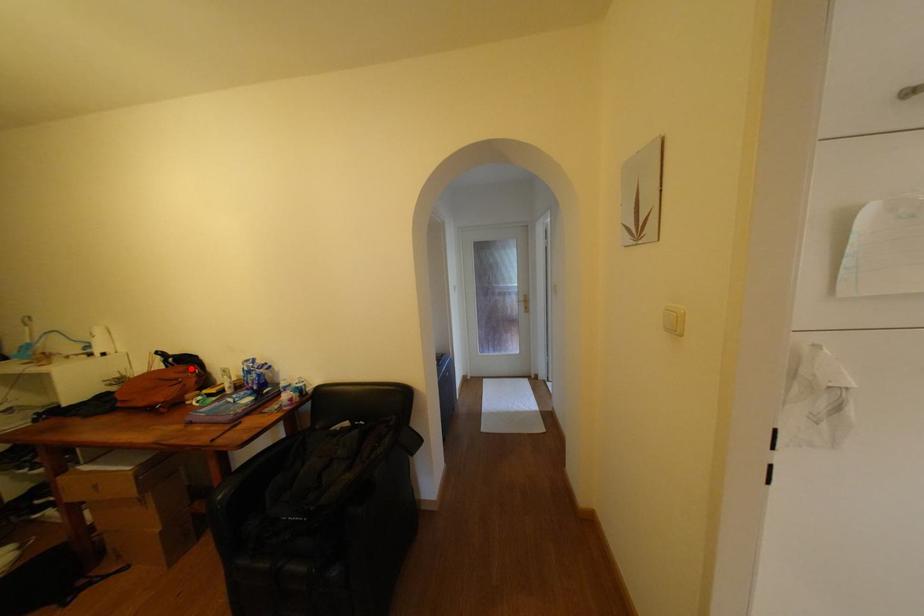
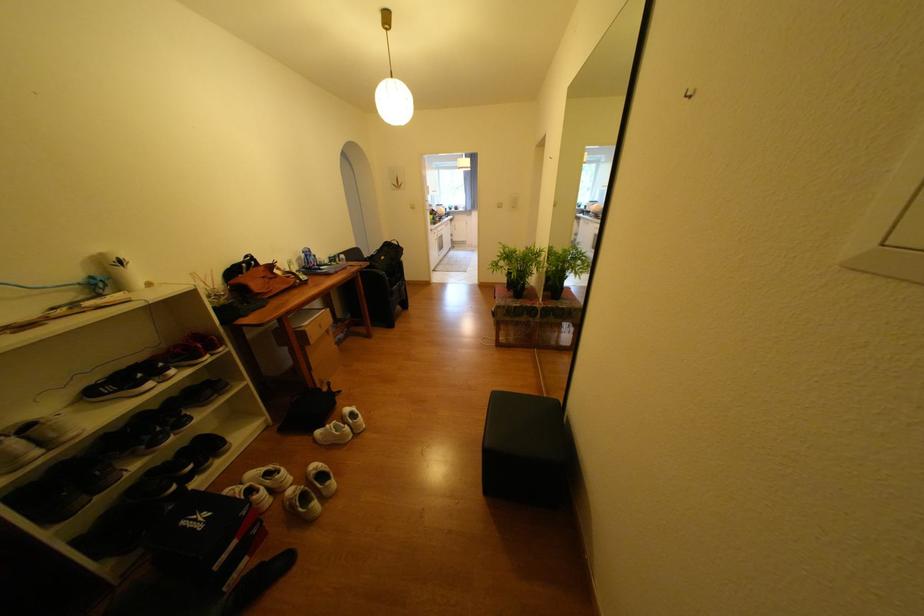
Find the pixel in the second image that matches the highlighted location in the first image.

(271, 269)